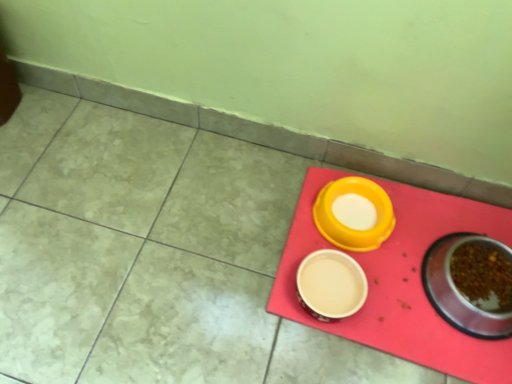
Question: Considering the positions of metallic stainless steel bowl at lower right, which is counted as the first tableware, starting from the right, and rubberized red tray at lower right in the image, is metallic stainless steel bowl at lower right, which is counted as the first tableware, starting from the right, wider or thinner than rubberized red tray at lower right?

Choices:
 (A) thin
 (B) wide

Answer: (A)

Question: From their relative heights in the image, would you say metallic stainless steel bowl at lower right, which is counted as the first tableware, starting from the right, is taller or shorter than rubberized red tray at lower right?

Choices:
 (A) tall
 (B) short

Answer: (A)

Question: Based on their relative distances, which object is nearer to the yellow plastic bowl at center, which appears as the 2th tableware when viewed from the left?

Choices:
 (A) beige ceramic bowl at center, placed as the 3th tableware when sorted from right to left
 (B) metallic stainless steel bowl at lower right, the third tableware positioned from the left
 (C) rubberized red tray at lower right

Answer: (A)

Question: Considering the real-world distances, which object is closest to the rubberized red tray at lower right?

Choices:
 (A) beige ceramic bowl at center, the first tableware in the left-to-right sequence
 (B) metallic stainless steel bowl at lower right, which is counted as the first tableware, starting from the right
 (C) yellow plastic bowl at center, which appears as the 2th tableware when viewed from the left

Answer: (B)